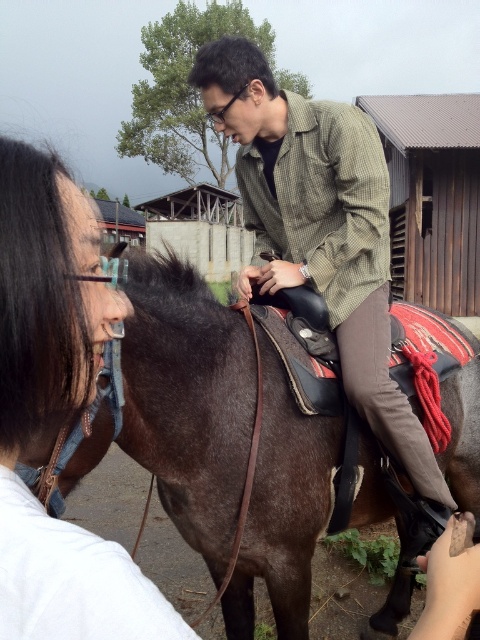
Measure the distance from brown leather horse at center to green checkered shirt at center.

brown leather horse at center is 49.76 centimeters away from green checkered shirt at center.

Which of these two, brown leather horse at center or green checkered shirt at center, stands shorter?

brown leather horse at center

Which is in front, point (239, 476) or point (375, 394)?

Point (239, 476) is in front.

This screenshot has height=640, width=480. What are the coordinates of `brown leather horse at center` in the screenshot? It's located at (188, 400).

Who is more forward, (157, 420) or (10, 620)?

Point (10, 620) is more forward.

Who is more forward, (131, 436) or (88, 397)?

Point (88, 397) is in front.

The width and height of the screenshot is (480, 640). Find the location of `brown leather horse at center`. brown leather horse at center is located at coordinates (188, 400).

Does smooth brown hair at left have a lesser width compared to green checkered shirt at center?

Indeed, smooth brown hair at left has a lesser width compared to green checkered shirt at center.

The width and height of the screenshot is (480, 640). I want to click on smooth brown hair at left, so click(57, 412).